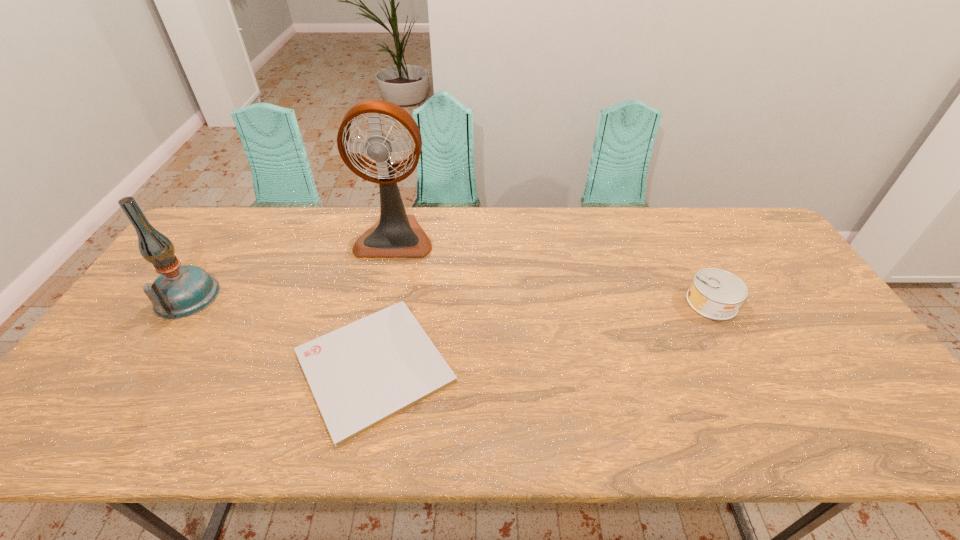
The height and width of the screenshot is (540, 960). What are the coordinates of `vacant space that satisfies the following two spatial constraints: 1. on the front side of the third tallest object; 2. on the left side of the leftmost object` in the screenshot? It's located at (183, 302).

The height and width of the screenshot is (540, 960). I want to click on vacant space that satisfies the following two spatial constraints: 1. on the front-facing side of the second shortest object; 2. on the left side of the farthest object, so click(380, 302).

Locate an element on the screen. The width and height of the screenshot is (960, 540). free space in the image that satisfies the following two spatial constraints: 1. on the front-facing side of the shortest object; 2. on the left side of the fan is located at coordinates (367, 366).

Find the location of a particular element. The image size is (960, 540). vacant region that satisfies the following two spatial constraints: 1. on the front-facing side of the can; 2. on the right side of the tallest object is located at coordinates [380, 302].

I want to click on free space that satisfies the following two spatial constraints: 1. on the front-facing side of the tallest object; 2. on the right side of the third tallest object, so click(x=380, y=302).